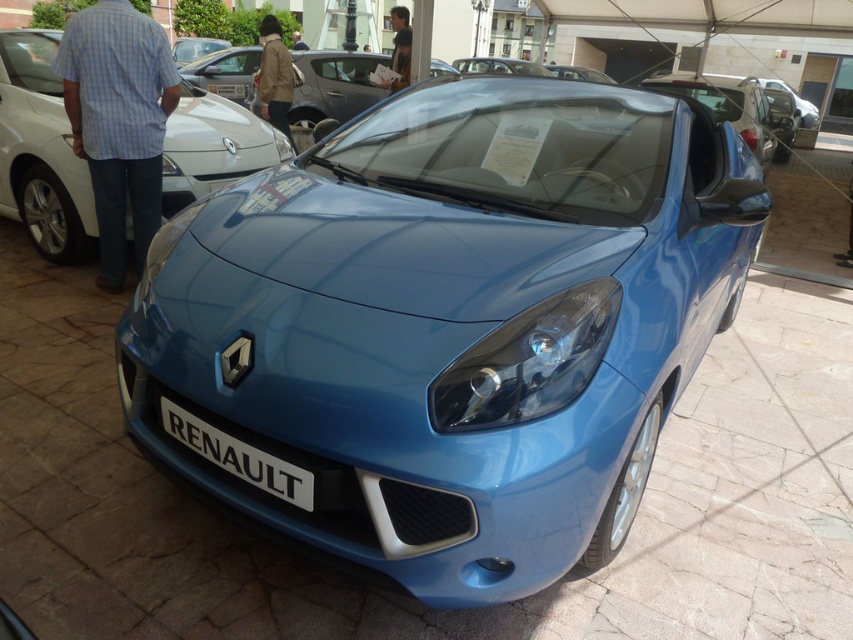
Based on the photo, which of these two, glossy blue car at center or metallic blue car at center, stands shorter?

With less height is metallic blue car at center.

Is glossy blue car at center taller than metallic blue car at center?

Yes, glossy blue car at center is taller than metallic blue car at center.

At what (x,y) coordinates should I click in order to perform the action: click on glossy blue car at center. Please return your answer as a coordinate pair (x, y). Looking at the image, I should click on (448, 326).

This screenshot has width=853, height=640. Find the location of `glossy blue car at center`. glossy blue car at center is located at coordinates (448, 326).

Does blue cotton shirt at left have a greater height compared to dark brown leather jacket at upper center?

Incorrect, blue cotton shirt at left's height is not larger of dark brown leather jacket at upper center's.

Is blue cotton shirt at left smaller than dark brown leather jacket at upper center?

Yes, blue cotton shirt at left is smaller than dark brown leather jacket at upper center.

Does point (120, 248) come behind point (395, 44)?

No, it is not.

Image resolution: width=853 pixels, height=640 pixels. Identify the location of blue cotton shirt at left. (119, 122).

Who is more distant from viewer, [111,70] or [264,486]?

Point [111,70]

What do you see at coordinates (119, 122) in the screenshot?
I see `blue cotton shirt at left` at bounding box center [119, 122].

Is point (115, 33) farther from viewer compared to point (189, 412)?

Yes, point (115, 33) is farther from viewer.

Identify the location of blue cotton shirt at left. This screenshot has height=640, width=853. (119, 122).